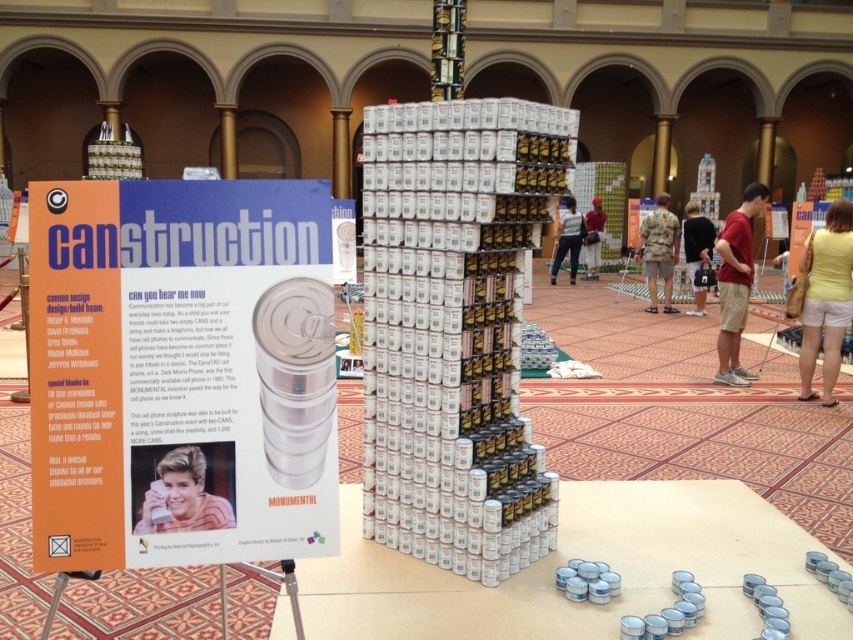
Who is positioned more to the right, smooth plastic phone at center or dark blue shirt at center?

dark blue shirt at center

Is point (184, 490) in front of point (695, 209)?

Yes, it is in front of point (695, 209).

Where is `smooth plastic phone at center`? smooth plastic phone at center is located at coordinates (183, 486).

Between point (207, 488) and point (808, 396), which one is positioned in front?

Point (207, 488) is in front.

Between smooth plastic phone at center and yellow cotton shorts at lower right, which one has less height?

→ With less height is smooth plastic phone at center.

You are a GUI agent. You are given a task and a screenshot of the screen. Output one action in this format:
    pyautogui.click(x=<x>, y=<y>)
    Task: Click on the smooth plastic phone at center
    The width and height of the screenshot is (853, 640).
    Given the screenshot: What is the action you would take?
    click(183, 486)

Locate an element on the screen. smooth plastic phone at center is located at coordinates (183, 486).

Does smooth plastic phone at center have a smaller size compared to matte red shirt at center?

Indeed, smooth plastic phone at center has a smaller size compared to matte red shirt at center.

Measure the distance between smooth plastic phone at center and camera.

smooth plastic phone at center is 6.90 feet away from camera.

Which is behind, point (164, 531) or point (718, 296)?

Point (718, 296)

The image size is (853, 640). Find the location of `smooth plastic phone at center`. smooth plastic phone at center is located at coordinates (183, 486).